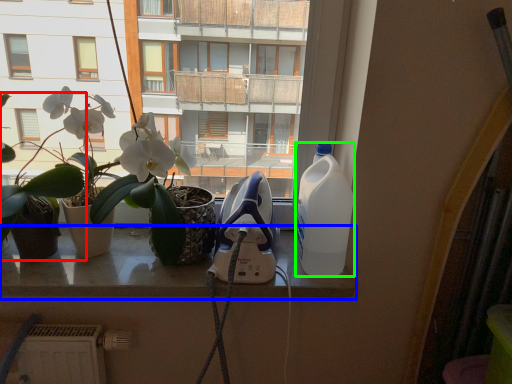
Question: Which object is positioned closest to houseplant (highlighted by a red box)? Select from window (highlighted by a blue box) and bottle (highlighted by a green box).

Choices:
 (A) window
 (B) bottle

Answer: (A)